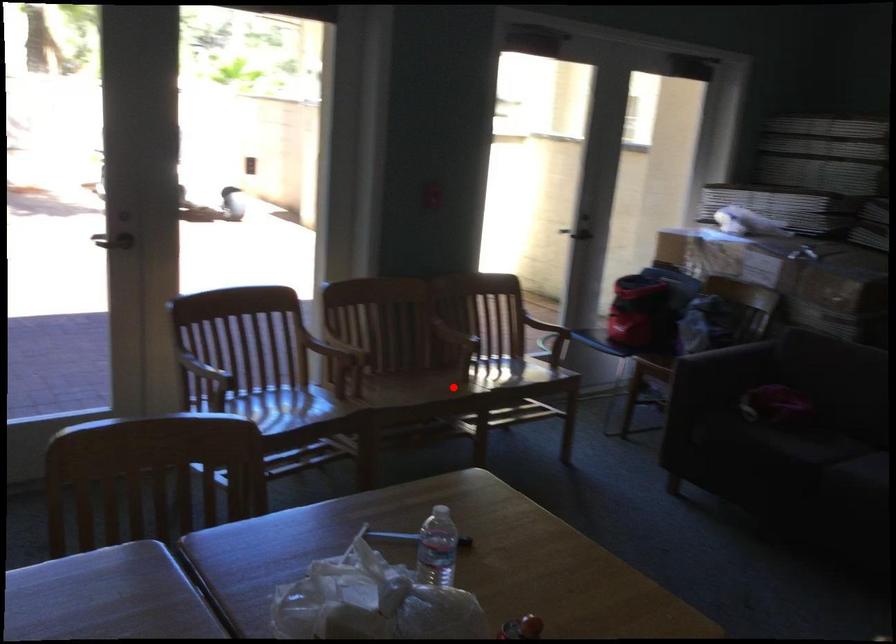
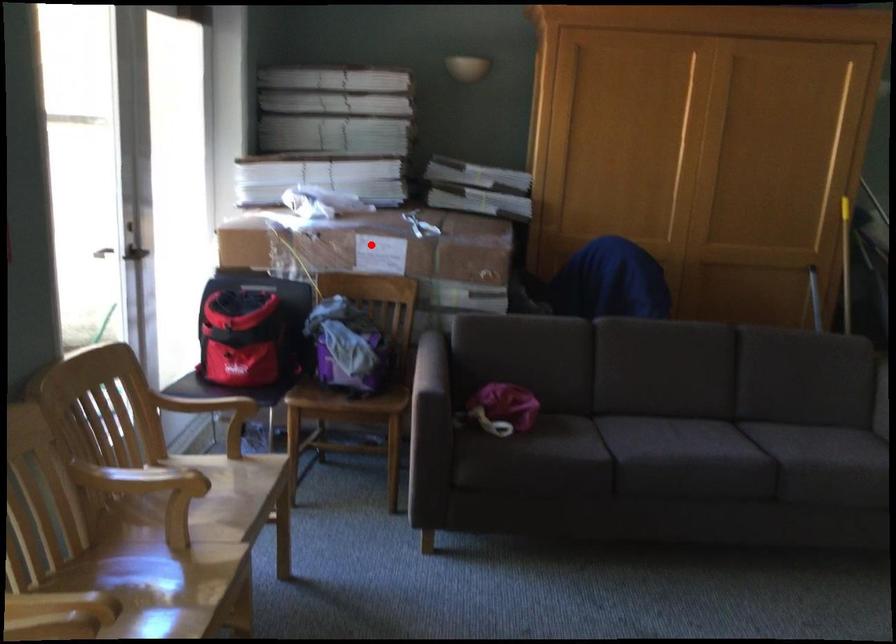
I am providing you with two images of the same scene from different viewpoints. A red point is marked on the first image and another point is marked on the second image. Is the marked point in image1 the same physical position as the marked point in image2?

No